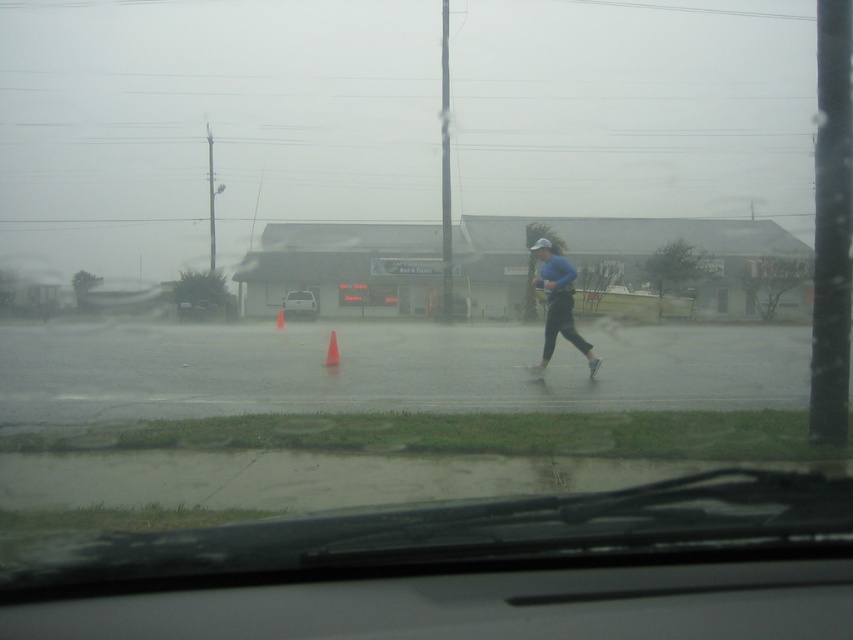
Question: Is white matte car at center above orange plastic cone at center?

Choices:
 (A) no
 (B) yes

Answer: (B)

Question: Is blue matte running suit at center bigger than white matte car at center?

Choices:
 (A) yes
 (B) no

Answer: (B)

Question: Considering the real-world distances, which object is farthest from the white matte car at center?

Choices:
 (A) orange plastic cone at center
 (B) blue matte running suit at center

Answer: (A)

Question: Among these points, which one is farthest from the camera?

Choices:
 (A) (276, 321)
 (B) (598, 362)
 (C) (312, 314)
 (D) (329, 333)

Answer: (C)

Question: Where is blue matte running suit at center located in relation to white matte car at center in the image?

Choices:
 (A) below
 (B) above

Answer: (A)

Question: Which of these objects is positioned closest to the orange cone at center?

Choices:
 (A) orange plastic cone at center
 (B) white matte car at center
 (C) blue matte running suit at center

Answer: (B)